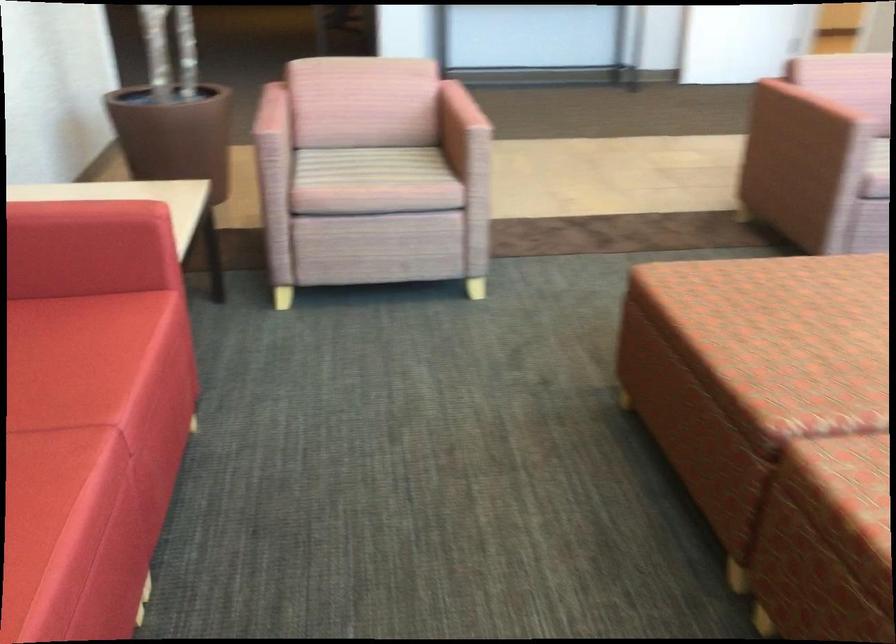
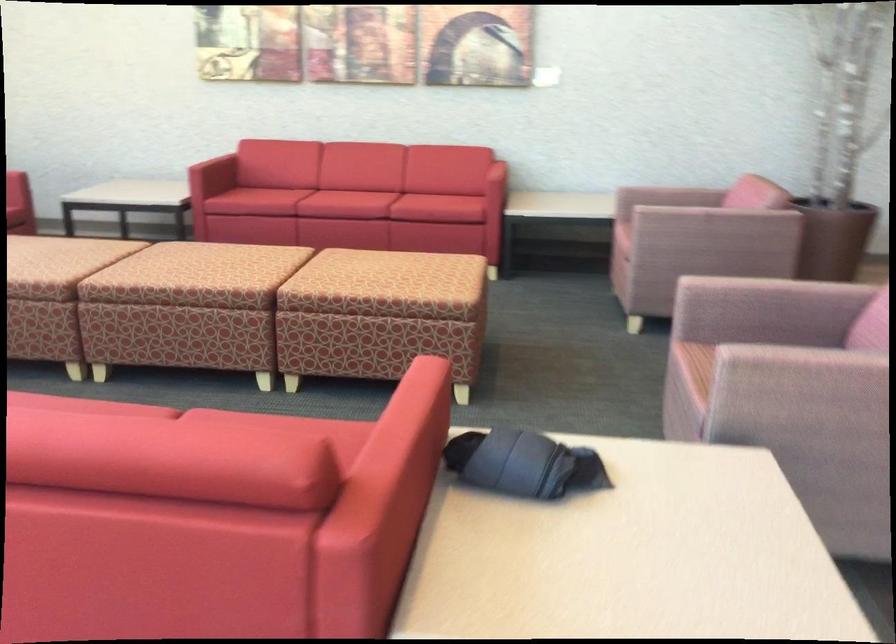
The point at (332, 134) is marked in the first image. Where is the corresponding point in the second image?

(669, 196)